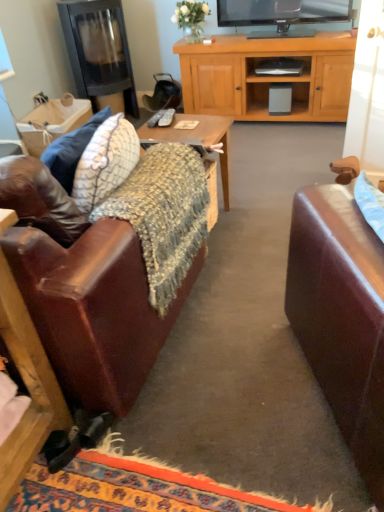
Question: Is matte gray remote control at center, marked as the first remote control in a right-to-left arrangement, in front of or behind natural woven picnic basket at upper left in the image?

Choices:
 (A) behind
 (B) front

Answer: (B)

Question: From a real-world perspective, relative to natural woven picnic basket at upper left, is matte gray remote control at center, marked as the 2th remote control in a left-to-right arrangement, vertically above or below?

Choices:
 (A) below
 (B) above

Answer: (B)

Question: Based on their relative distances, which object is nearer to the leather couch at left?

Choices:
 (A) knitted woolen blanket at center
 (B) white matte remote control at center, acting as the 2th remote control starting from the right
 (C) matte gray remote control at center, marked as the first remote control in a right-to-left arrangement
 (D) natural woven picnic basket at upper left
 (E) black glass fireplace at upper left

Answer: (A)

Question: Which is farther from the knitted woolen blanket at center?

Choices:
 (A) white matte remote control at center, acting as the 2th remote control starting from the right
 (B) knitted fabric desk at center
 (C) leather couch at left
 (D) matte gray remote control at center, marked as the 2th remote control in a left-to-right arrangement
 (E) black glass fireplace at upper left

Answer: (E)